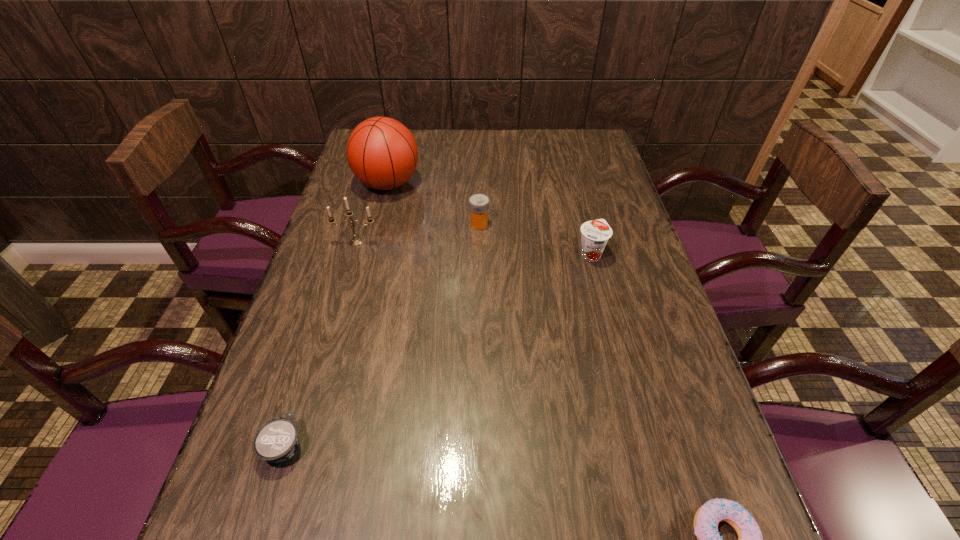
Image resolution: width=960 pixels, height=540 pixels. I want to click on the tallest object, so click(382, 153).

This screenshot has width=960, height=540. I want to click on the farthest object, so click(x=382, y=153).

The image size is (960, 540). What are the coordinates of `the second tallest object` in the screenshot? It's located at (356, 241).

What are the coordinates of `medicine` in the screenshot? It's located at (478, 203).

In order to click on the third object from right to left in this screenshot , I will do `click(478, 203)`.

Where is `the right yogurt`? This screenshot has height=540, width=960. the right yogurt is located at coordinates (595, 234).

Locate an element on the screen. The width and height of the screenshot is (960, 540). the farther yogurt is located at coordinates point(595,234).

Where is `the second nearest object`? the second nearest object is located at coordinates (276, 441).

Find the location of a particular element. the shorter yogurt is located at coordinates (276, 441).

This screenshot has width=960, height=540. In order to click on vacant space located 0.280m on the right of the tallest object in this screenshot , I will do `click(511, 184)`.